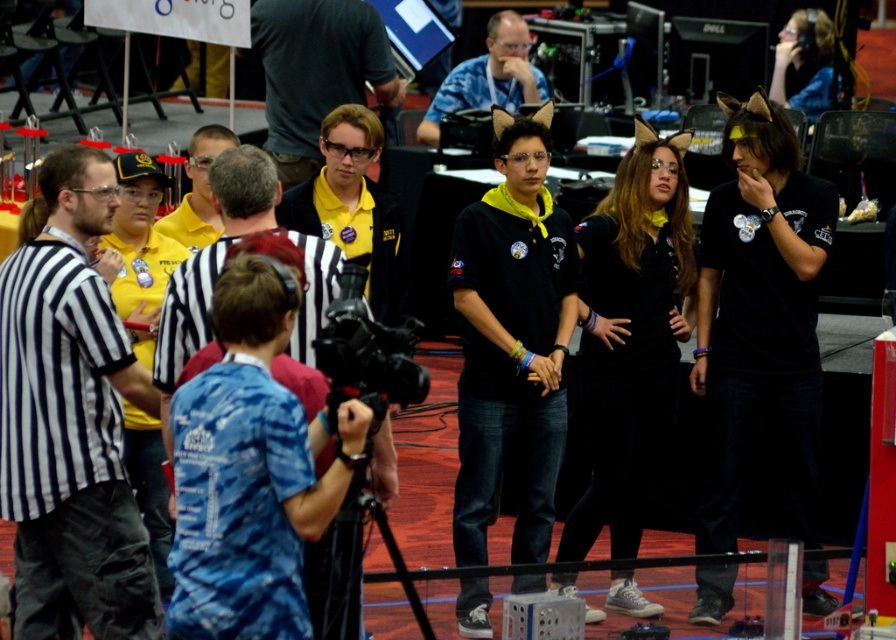
You are a photographer at the robotics competition and need to take a photo of both the black striped shirt at left and the blue fabric shirt at center. Based on their positions, which one should you focus on first to ensure both are in frame?

You should focus on the blue fabric shirt at center first because the black striped shirt at left is to the left of it, so positioning the camera to center the blue fabric shirt at center will naturally include the black striped shirt at left in the frame.

You are a photographer at the robotics competition and need to take a clear photo of the central figures. The matte yellow shirt at center and the black plastic video camera at center are both in your frame. Which object should you focus on to ensure it appears larger in the photo?

The matte yellow shirt at center is larger in size than the black plastic video camera at center, so focusing on the matte yellow shirt at center would make it appear larger in the photo.

You are a participant in the robotics competition and need to locate your team members wearing the matte yellow shirt at center and the blue fabric shirt at center. From your vantage point at the back of the hall, which team member is closer to the floor?

The matte yellow shirt at center is located below the blue fabric shirt at center, so the team member wearing the matte yellow shirt at center is closer to the floor.